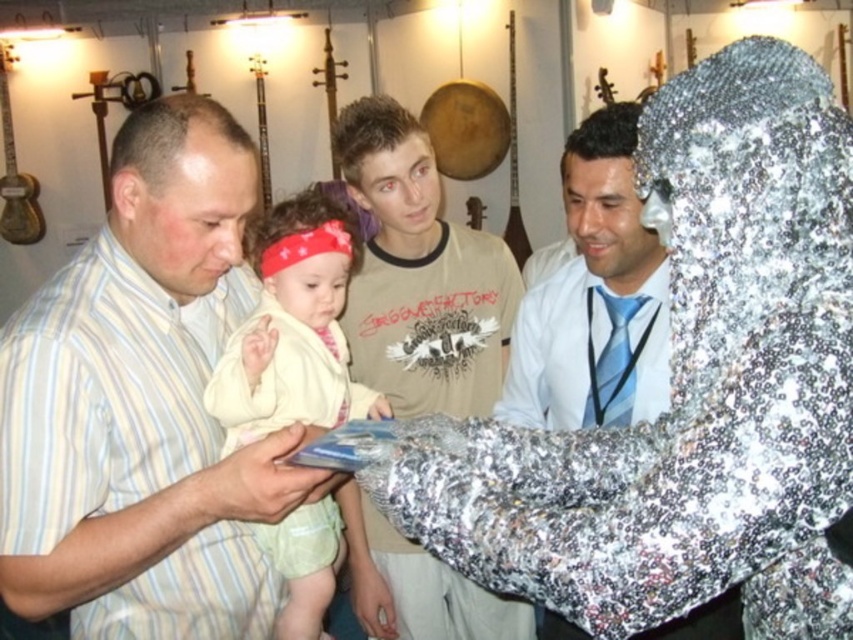
Measure the distance from matte beige t-shirt at center to shiny sequined jacket at center.

33.94 centimeters

Can you confirm if matte beige t-shirt at center is positioned to the left of shiny sequined jacket at center?

Indeed, matte beige t-shirt at center is positioned on the left side of shiny sequined jacket at center.

Which is behind, point (350, 328) or point (540, 355)?

The point (350, 328) is more distant.

The width and height of the screenshot is (853, 640). In order to click on matte beige t-shirt at center in this screenshot , I will do `click(419, 275)`.

Is shiny sequined jacket at center wider than light yellow fabric baby at center?

Indeed, shiny sequined jacket at center has a greater width compared to light yellow fabric baby at center.

At what (x,y) coordinates should I click in order to perform the action: click on shiny sequined jacket at center. Please return your answer as a coordinate pair (x, y). Looking at the image, I should click on 595,298.

Is point (631, 164) farther from camera compared to point (218, 365)?

No.

Where is `shiny sequined jacket at center`? The width and height of the screenshot is (853, 640). shiny sequined jacket at center is located at coordinates (595, 298).

Can you confirm if shiny sequined jacket at center is bigger than blue silk tie at center?

Correct, shiny sequined jacket at center is larger in size than blue silk tie at center.

Is shiny sequined jacket at center thinner than blue silk tie at center?

In fact, shiny sequined jacket at center might be wider than blue silk tie at center.

Between point (535, 410) and point (654, 314), which one is positioned in front?

Point (654, 314) is more forward.

At what (x,y) coordinates should I click in order to perform the action: click on shiny sequined jacket at center. Please return your answer as a coordinate pair (x, y). Image resolution: width=853 pixels, height=640 pixels. Looking at the image, I should click on (595, 298).